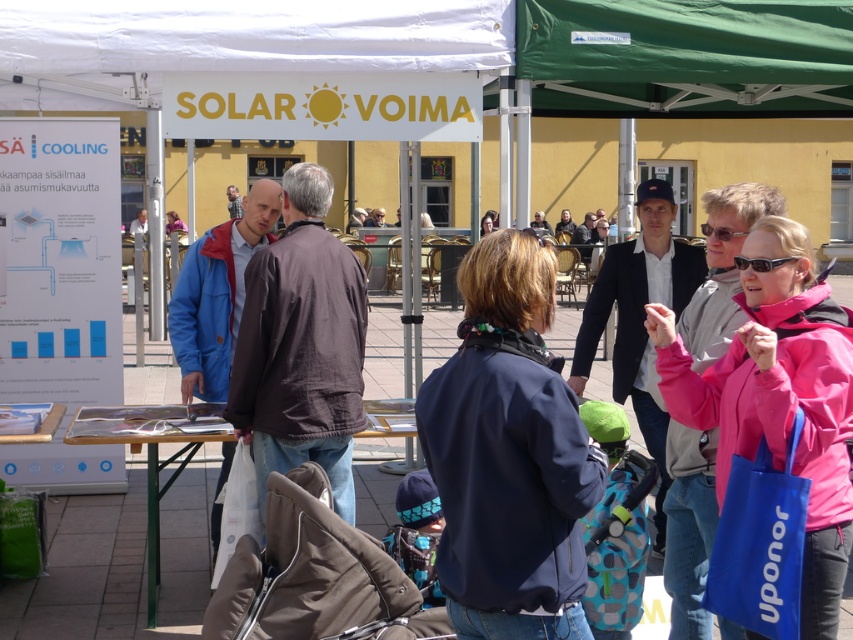
You are a visitor at the event and want to pick up the white paper at left and the pink softshell jacket at center. Which item is wider?

The white paper at left might be wider than pink softshell jacket at center according to the description.

You are standing at the entrance of the tent and want to move towards the two points marked in the image. Which point, point (192,273) or point (41,502), is closer to you?

Point (192,273) is closer to the viewer than point (41,502).